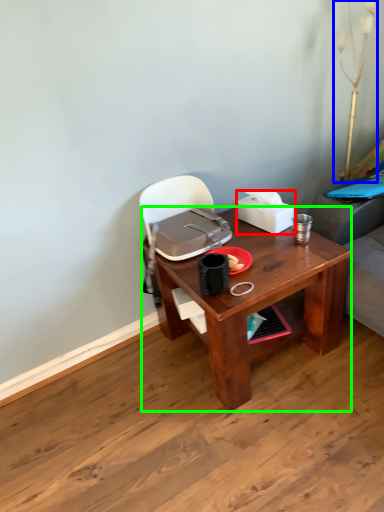
Question: Estimate the real-world distances between objects in this image. Which object is closer to box (highlighted by a red box), table lamp (highlighted by a blue box) or desk (highlighted by a green box)?

Choices:
 (A) table lamp
 (B) desk

Answer: (B)